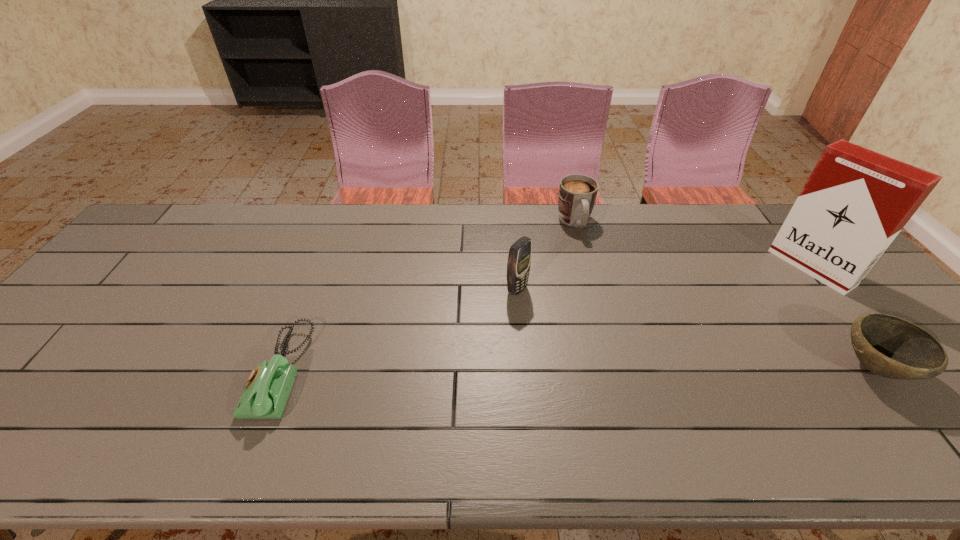
Locate an element on the screen. telephone is located at coordinates (267, 389).

Where is `the shortest object`? The image size is (960, 540). the shortest object is located at coordinates (267, 389).

This screenshot has height=540, width=960. I want to click on the fourth tallest object, so click(888, 346).

Locate an element on the screen. This screenshot has width=960, height=540. mug is located at coordinates (577, 193).

This screenshot has height=540, width=960. I want to click on the third object from right to left, so click(x=577, y=193).

Identify the location of the fourth object from right to left. (519, 259).

At what (x,y) coordinates should I click in order to perform the action: click on cellular telephone. Please return your answer as a coordinate pair (x, y). Looking at the image, I should click on (519, 259).

Find the location of a particular element. This screenshot has height=540, width=960. the tallest object is located at coordinates (855, 202).

This screenshot has height=540, width=960. I want to click on vacant space located on the dial of the shortest object, so click(x=127, y=372).

Locate an element on the screen. The image size is (960, 540). free location located 0.320m on the dial of the shortest object is located at coordinates (123, 372).